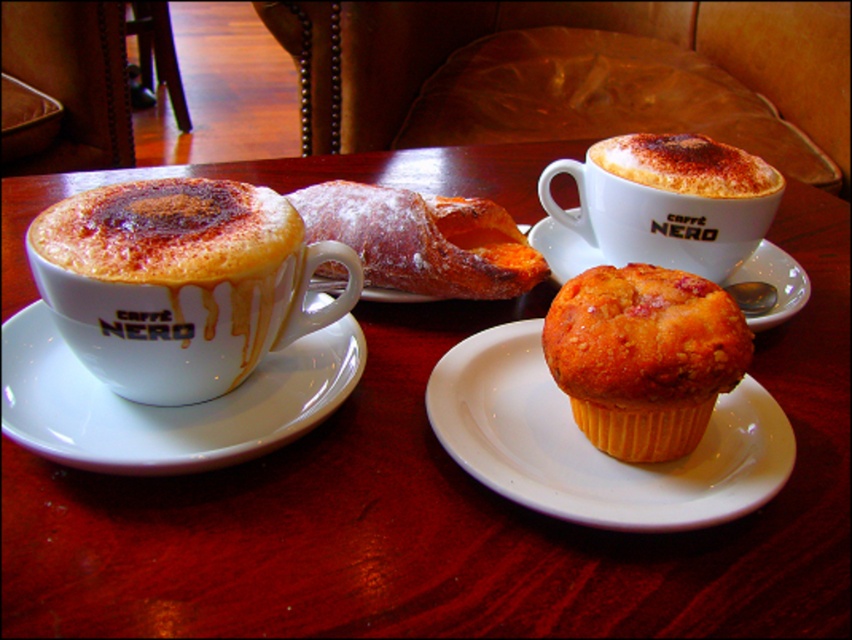
Is white ceramic saucer at left taller than golden brown sugar-coated pastry at center?

In fact, white ceramic saucer at left may be shorter than golden brown sugar-coated pastry at center.

Does point (318, 419) lie behind point (427, 195)?

No, (318, 419) is in front of (427, 195).

The image size is (852, 640). Identify the location of white ceramic saucer at left. (165, 406).

Can you confirm if matte white cup at left is wider than matte white cup at upper right?

No, matte white cup at left is not wider than matte white cup at upper right.

Between matte white cup at left and matte white cup at upper right, which one appears on the right side from the viewer's perspective?

Positioned to the right is matte white cup at upper right.

Identify the location of matte white cup at left. This screenshot has width=852, height=640. (180, 282).

Between matte white cup at left and white ceramic saucer at left, which one is positioned higher?

matte white cup at left is above.

Can you confirm if matte white cup at left is positioned above white ceramic saucer at left?

Indeed, matte white cup at left is positioned over white ceramic saucer at left.

Image resolution: width=852 pixels, height=640 pixels. What do you see at coordinates (180, 282) in the screenshot?
I see `matte white cup at left` at bounding box center [180, 282].

Where is `matte white cup at left`? The width and height of the screenshot is (852, 640). matte white cup at left is located at coordinates tap(180, 282).